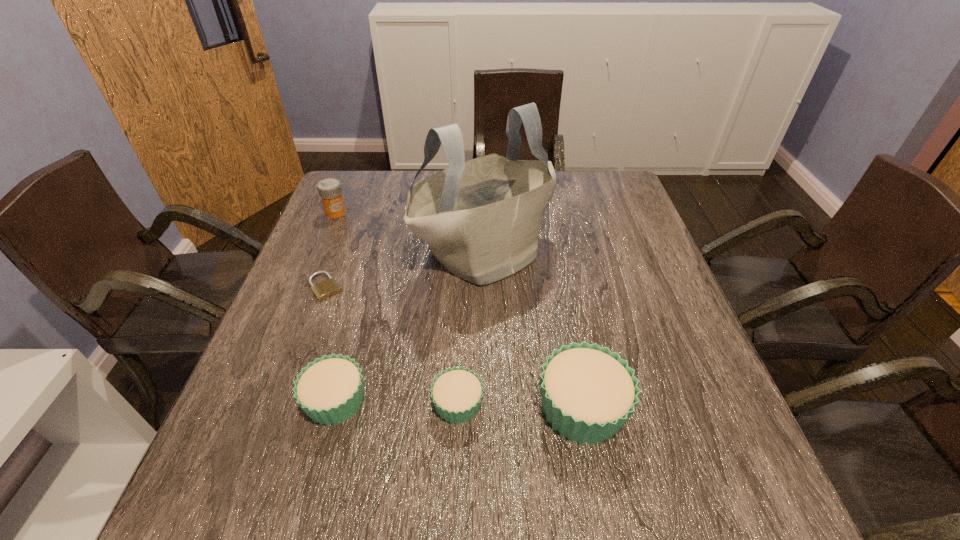
The width and height of the screenshot is (960, 540). What are the coordinates of `cupcake identified as the third closest to the shopping bag` in the screenshot? It's located at (457, 393).

Where is `vacant area in the image that satisfies the following two spatial constraints: 1. on the back side of the padlock; 2. on the left side of the shopping bag`? This screenshot has width=960, height=540. vacant area in the image that satisfies the following two spatial constraints: 1. on the back side of the padlock; 2. on the left side of the shopping bag is located at coordinates (338, 253).

This screenshot has height=540, width=960. Find the location of `free location that satisfies the following two spatial constraints: 1. on the front side of the padlock; 2. on the right side of the rightmost cupcake`. free location that satisfies the following two spatial constraints: 1. on the front side of the padlock; 2. on the right side of the rightmost cupcake is located at coordinates (281, 408).

Find the location of a particular element. The width and height of the screenshot is (960, 540). vacant position in the image that satisfies the following two spatial constraints: 1. on the label side of the farthest object; 2. on the left side of the second cupcake from left to right is located at coordinates pos(256,404).

The height and width of the screenshot is (540, 960). What are the coordinates of `free space that satisfies the following two spatial constraints: 1. on the label side of the rightmost cupcake; 2. on the left side of the medicine` in the screenshot? It's located at (254, 408).